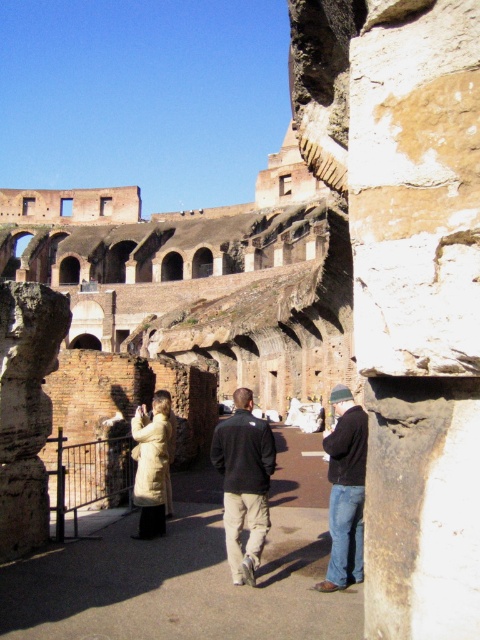
Does weathered stone column at center have a smaller size compared to beige wool coat at center?

Incorrect, weathered stone column at center is not smaller in size than beige wool coat at center.

Does weathered stone column at center have a lesser height compared to beige wool coat at center?

In fact, weathered stone column at center may be taller than beige wool coat at center.

Is point (400, 76) behind point (151, 433)?

No, (400, 76) is closer to viewer.

Locate an element on the screen. weathered stone column at center is located at coordinates (418, 312).

Does dark gray fleece jacket at center appear under dark blue jeans at center?

No, dark gray fleece jacket at center is not below dark blue jeans at center.

At what (x,y) coordinates should I click in order to perform the action: click on dark gray fleece jacket at center. Please return your answer as a coordinate pair (x, y). Looking at the image, I should click on (243, 483).

You are a GUI agent. You are given a task and a screenshot of the screen. Output one action in this format:
    pyautogui.click(x=<x>, y=<y>)
    Task: Click on the dark gray fleece jacket at center
    Image resolution: width=480 pixels, height=640 pixels.
    Given the screenshot: What is the action you would take?
    pyautogui.click(x=243, y=483)

This screenshot has height=640, width=480. I want to click on dark gray fleece jacket at center, so click(243, 483).

Which is above, dark gray fleece jacket at center or beige wool coat at center?

Positioned higher is dark gray fleece jacket at center.

The height and width of the screenshot is (640, 480). I want to click on dark gray fleece jacket at center, so click(x=243, y=483).

Where is `dark gray fleece jacket at center`? Image resolution: width=480 pixels, height=640 pixels. dark gray fleece jacket at center is located at coordinates (x=243, y=483).